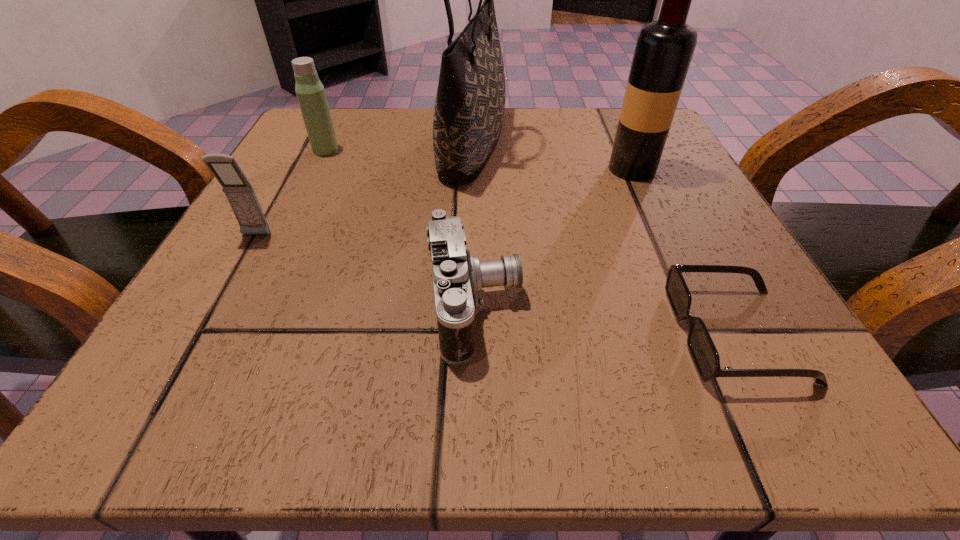
Identify the location of vacant region located 0.210m on the front-facing side of the fourth farthest object. (186, 361).

What are the coordinates of `free space located at the lens of the camera` in the screenshot? It's located at (762, 307).

Where is `vacant region located on the front-facing side of the shortest object`? vacant region located on the front-facing side of the shortest object is located at coordinates (429, 335).

Identify the location of blank space located 0.060m on the front-facing side of the shortest object. This screenshot has height=540, width=960. (625, 335).

Where is `free point located 0.270m on the front-facing side of the shortest object`? free point located 0.270m on the front-facing side of the shortest object is located at coordinates (446, 335).

You are a GUI agent. You are given a task and a screenshot of the screen. Output one action in this format:
    pyautogui.click(x=<x>, y=<y>)
    Task: Click on the tote bag that is at the far edge
    This screenshot has width=960, height=540.
    Given the screenshot: What is the action you would take?
    pyautogui.click(x=470, y=103)

Locate an element on the screen. The height and width of the screenshot is (540, 960). wine bottle that is positioned at the far edge is located at coordinates (664, 48).

The height and width of the screenshot is (540, 960). I want to click on thermos bottle at the far edge, so click(x=310, y=92).

You are a GUI agent. You are given a task and a screenshot of the screen. Output one action in this format:
    pyautogui.click(x=<x>, y=<y>)
    Task: Click on the camera located at the near edge
    Image resolution: width=960 pixels, height=540 pixels.
    Given the screenshot: What is the action you would take?
    pyautogui.click(x=457, y=276)

Find the location of a particular element. The width and height of the screenshot is (960, 540). sunglasses situated at the near edge is located at coordinates (705, 356).